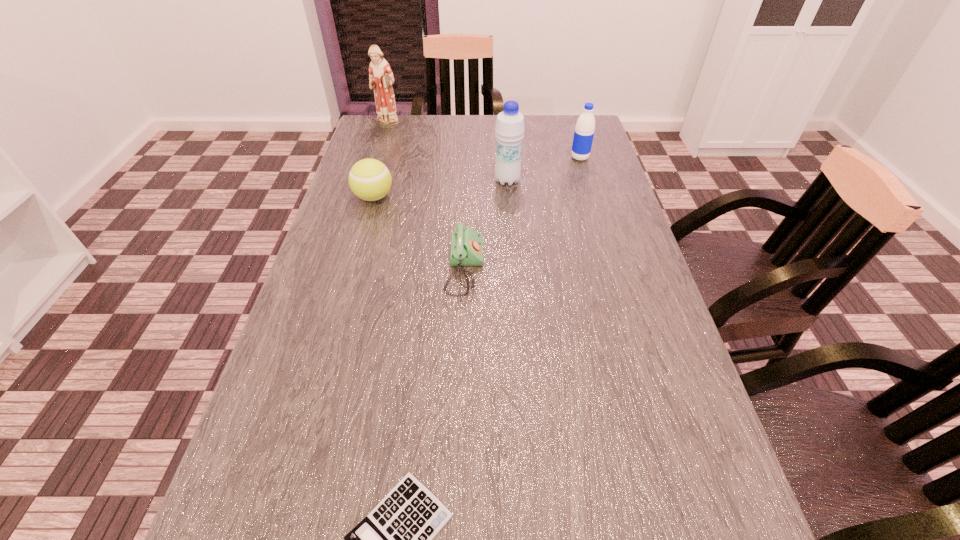
Image resolution: width=960 pixels, height=540 pixels. In order to click on blank space that satisfies the following two spatial constraints: 1. on the front-facing side of the figurine; 2. on the left side of the left water bottle in this screenshot , I will do `click(371, 180)`.

I want to click on free space that satisfies the following two spatial constraints: 1. on the front-facing side of the farthest object; 2. on the right side of the left water bottle, so click(371, 180).